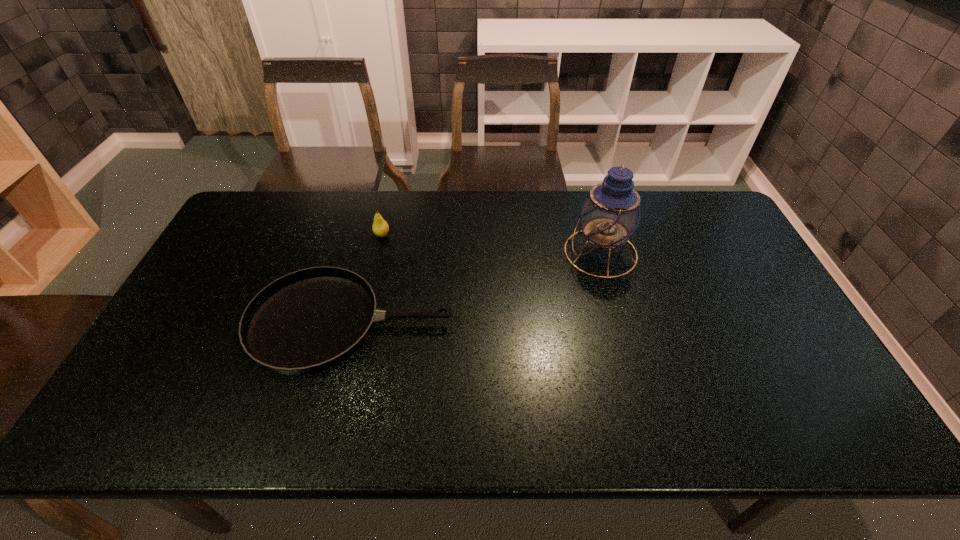
This screenshot has height=540, width=960. I want to click on pear situated at the far edge, so click(x=380, y=227).

Where is `vacant space at the far edge of the desktop`? The width and height of the screenshot is (960, 540). vacant space at the far edge of the desktop is located at coordinates (545, 213).

Find the location of a particular element. The image size is (960, 540). vacant space at the near edge is located at coordinates (410, 409).

Find the location of a particular element. The image size is (960, 540). free location at the left edge is located at coordinates (190, 392).

Identify the location of vacant space at the right edge. (732, 245).

In the image, there is a desktop. Identify the location of vacant space at the near left corner. The height and width of the screenshot is (540, 960). (147, 422).

Locate an element on the screen. The width and height of the screenshot is (960, 540). blank area at the far right corner is located at coordinates (693, 199).

Find the location of a particular element. Image resolution: width=960 pixels, height=540 pixels. free space between the frying pan and the pear is located at coordinates (367, 279).

The image size is (960, 540). I want to click on unoccupied area between the shortest object and the rightmost object, so click(476, 288).

In order to click on vacant region between the rightmost object and the second shortest object in this screenshot , I will do `click(492, 244)`.